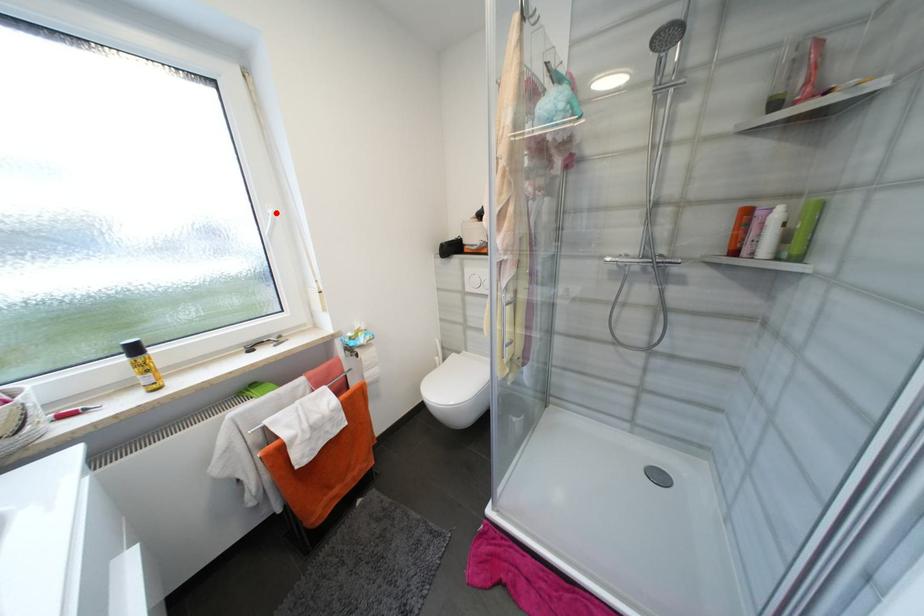
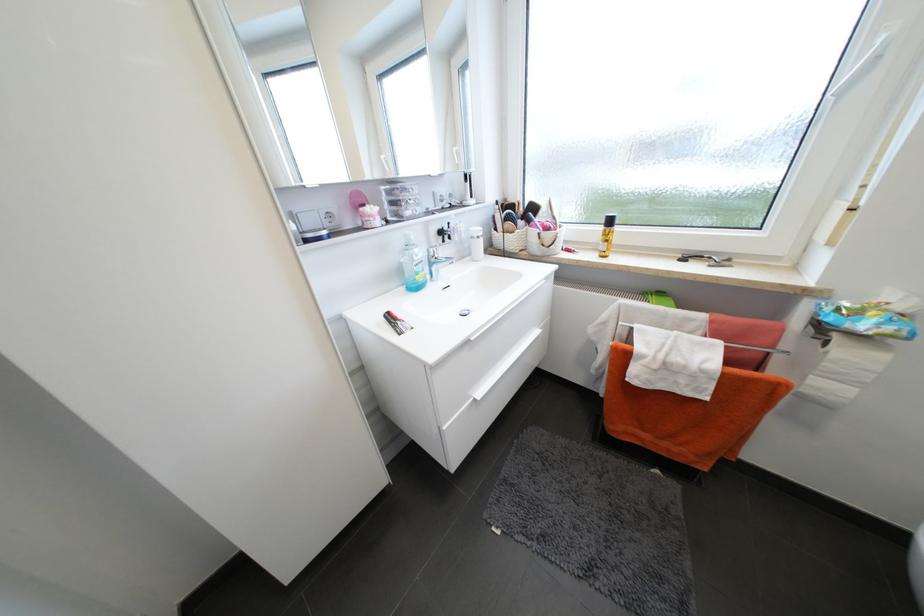
Locate, in the second image, the point that corresponds to the highlighted location in the first image.

(888, 41)